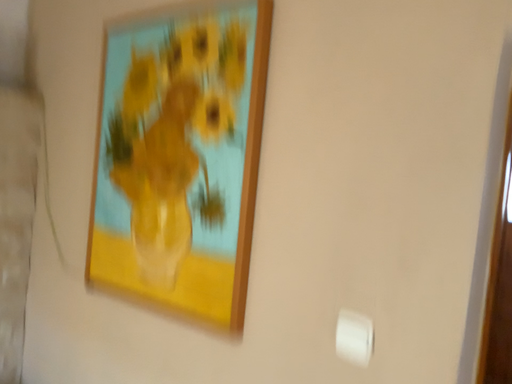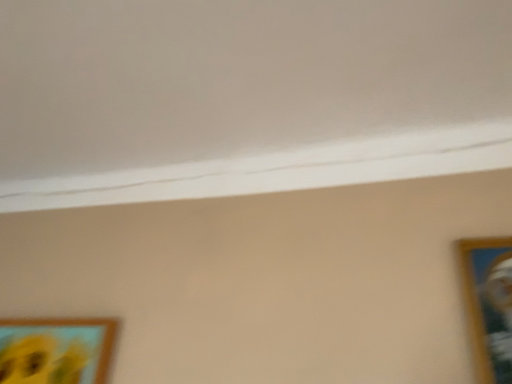
Question: Which way did the camera rotate in the video?

Choices:
 (A) rotated right
 (B) rotated left

Answer: (A)